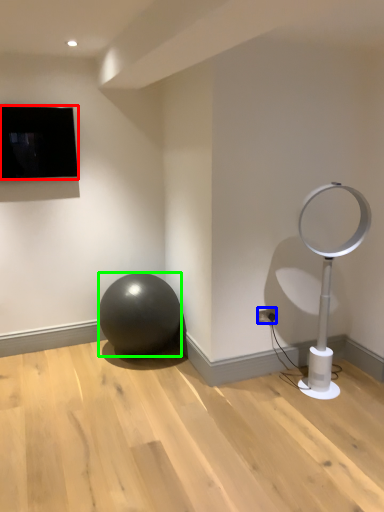
Question: Which is nearer to the television (highlighted by a red box)? electric outlet (highlighted by a blue box) or ball (highlighted by a green box).

Choices:
 (A) electric outlet
 (B) ball

Answer: (B)